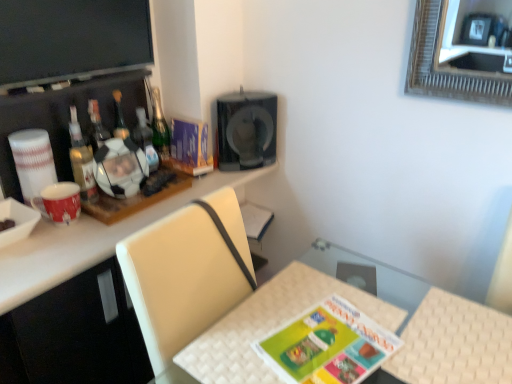
Identify the location of free spot above white woven table at lower center (from a real-world perspective). This screenshot has height=384, width=512. (303, 331).